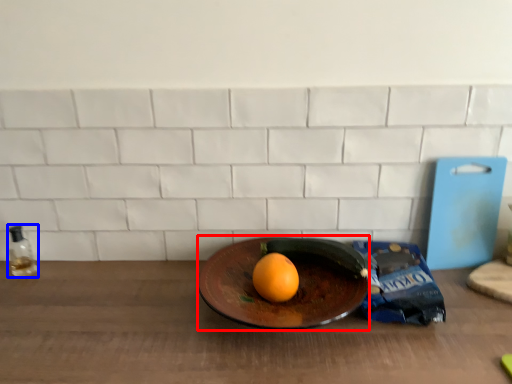
Question: Which point is further to the camera, plate (highlighted by a red box) or bottle (highlighted by a blue box)?

Choices:
 (A) plate
 (B) bottle

Answer: (B)